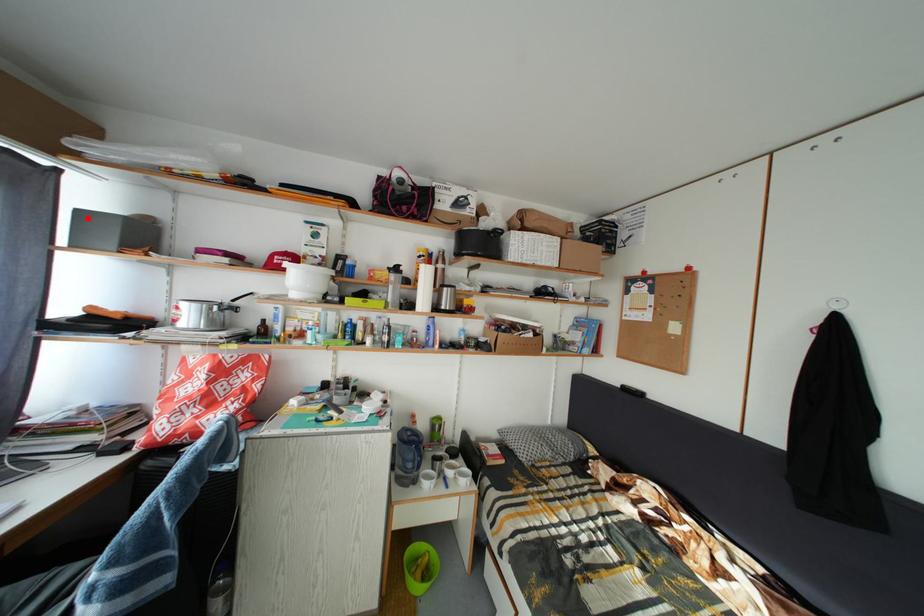
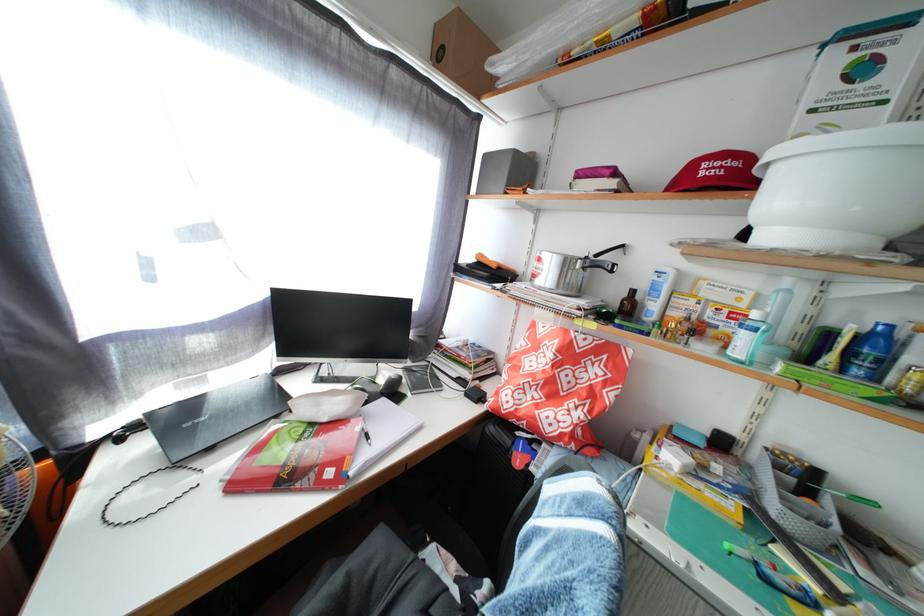
Locate, in the second image, the point that corresponds to the highlighted location in the first image.

(494, 163)